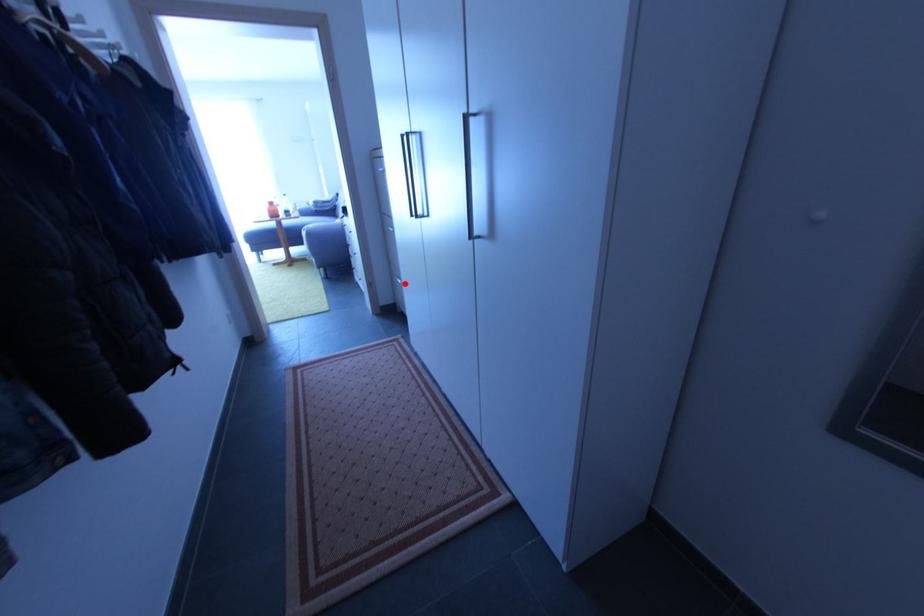
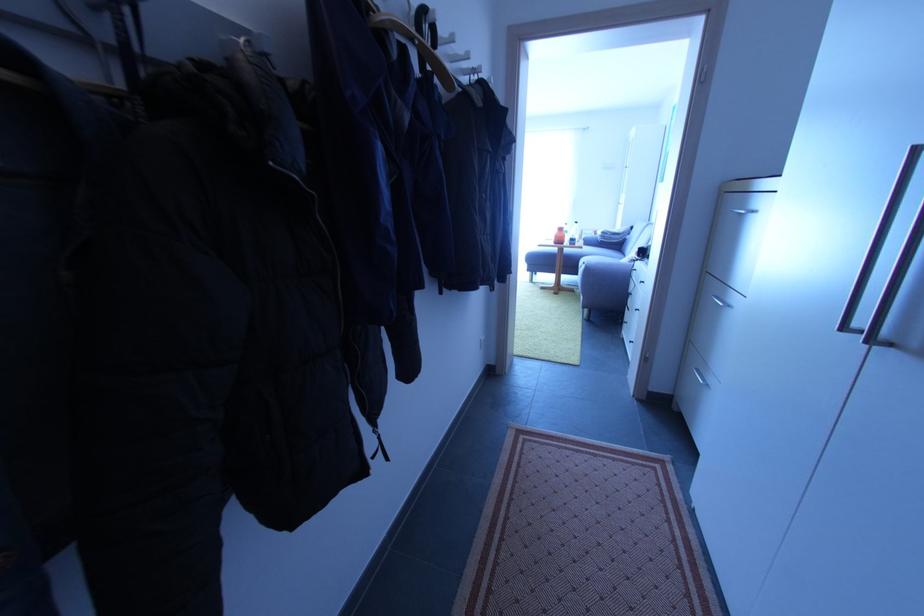
Find the pixel in the second image that matches the highlighted location in the first image.

(706, 383)